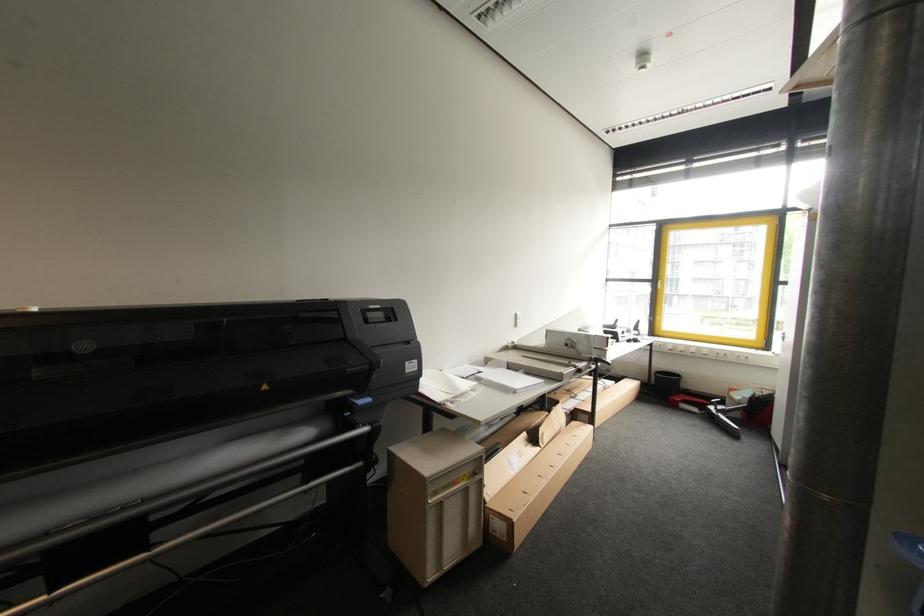
You are a GUI agent. You are given a task and a screenshot of the screen. Output one action in this format:
    pyautogui.click(x=<x>, y=<y>)
    Task: Click on the paper cutter handle
    This screenshot has height=616, width=924.
    Given the screenshot: What is the action you would take?
    pyautogui.click(x=602, y=362)